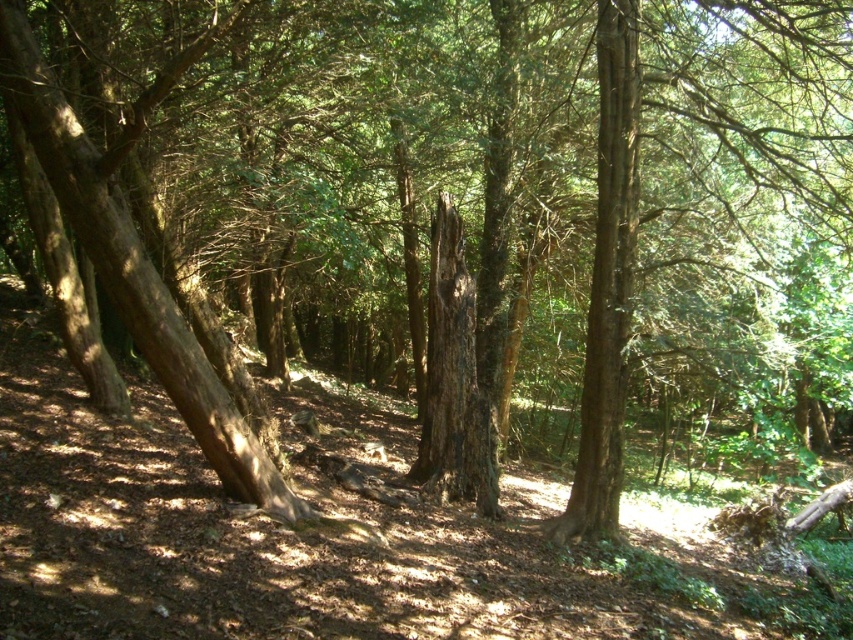
Question: Does brown rough tree trunk at left have a lesser width compared to brown rough bark tree trunk at center?

Choices:
 (A) no
 (B) yes

Answer: (A)

Question: Does brown rough tree trunk at left appear over brown rough bark tree trunk at center?

Choices:
 (A) no
 (B) yes

Answer: (A)

Question: Where is brown rough tree trunk at left located in relation to brown rough bark tree trunk at center in the image?

Choices:
 (A) left
 (B) right

Answer: (A)

Question: Which of the following is the closest to the observer?

Choices:
 (A) (196, 401)
 (B) (590, 314)

Answer: (A)

Question: Which of the following is the farthest from the observer?

Choices:
 (A) brown rough bark tree trunk at center
 (B) brown rough tree trunk at left

Answer: (A)

Question: Which of the following is the farthest from the observer?

Choices:
 (A) brown rough bark tree trunk at center
 (B) brown rough tree trunk at left
 (C) dark brown rough bark tree trunk at center

Answer: (C)